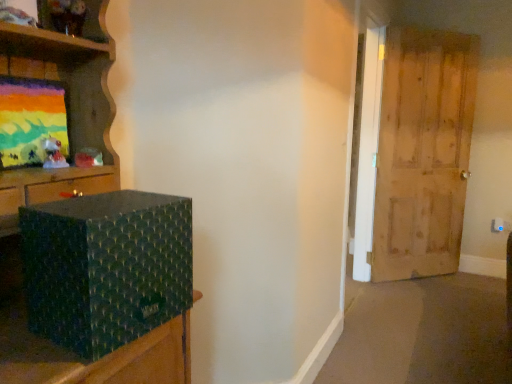
Question: Considering the positions of green textured box at left and wooden door at right in the image, is green textured box at left wider or thinner than wooden door at right?

Choices:
 (A) wide
 (B) thin

Answer: (A)

Question: In the image, is green textured box at left positioned in front of or behind wooden door at right?

Choices:
 (A) behind
 (B) front

Answer: (B)

Question: Estimate the real-world distances between objects in this image. Which object is farther from the green textured box at left?

Choices:
 (A) matte painted canvas at upper left
 (B) wooden door at right

Answer: (B)

Question: Which of these objects is positioned farthest from the wooden door at right?

Choices:
 (A) green textured box at left
 (B) matte painted canvas at upper left

Answer: (B)